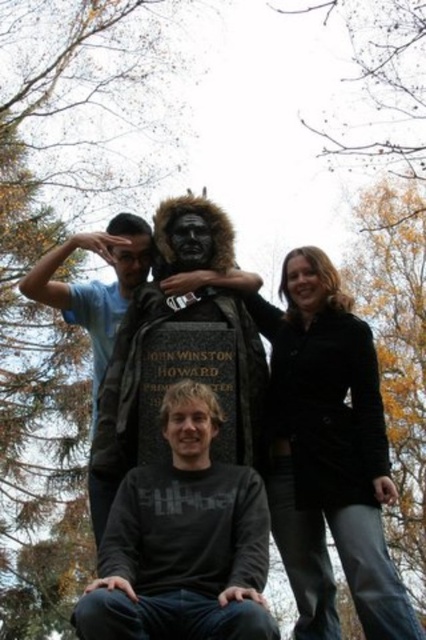
Based on the scene description, which object is positioned to the right when observing the matte black bust at center and the matte black mask at center?

The matte black bust at center is positioned to the right of the matte black mask at center.

You are standing in the park and see the statue of John Winston Howard. There is a point at coordinates (95,284). What object is located at that point?

The point at coordinates (95,284) corresponds to the light blue tshirt at left.